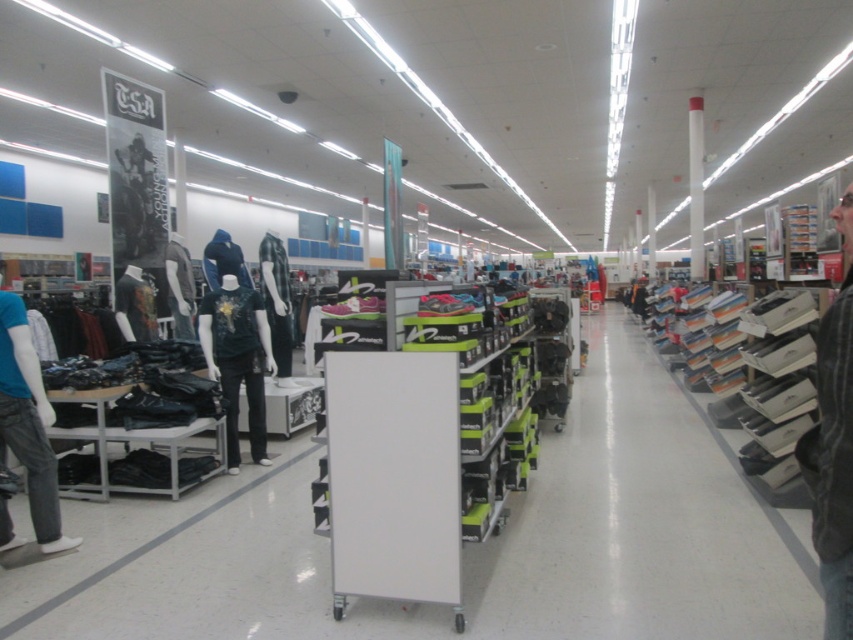
Is the position of black leather jacket at right more distant than that of dark green jersey at center?

No, it is in front of dark green jersey at center.

Can you confirm if black leather jacket at right is positioned above dark green jersey at center?

Correct, black leather jacket at right is located above dark green jersey at center.

Where is `black leather jacket at right`? The width and height of the screenshot is (853, 640). black leather jacket at right is located at coordinates (833, 444).

Who is more forward, [811,502] or [30,502]?

Positioned in front is point [811,502].

Between point (827, 368) and point (16, 316), which one is positioned behind?

Point (16, 316)

Locate an element on the screen. This screenshot has width=853, height=640. black leather jacket at right is located at coordinates (833, 444).

Who is more forward, (21, 324) or (202, 337)?

Point (21, 324)

Does denim jeans at left appear on the right side of dark green jersey at center?

In fact, denim jeans at left is to the left of dark green jersey at center.

I want to click on denim jeans at left, so click(x=28, y=422).